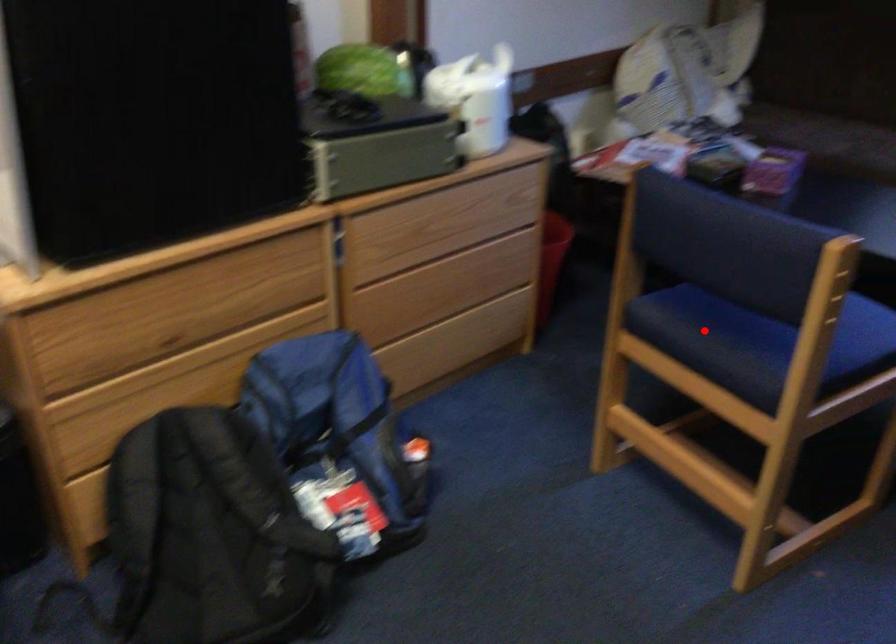
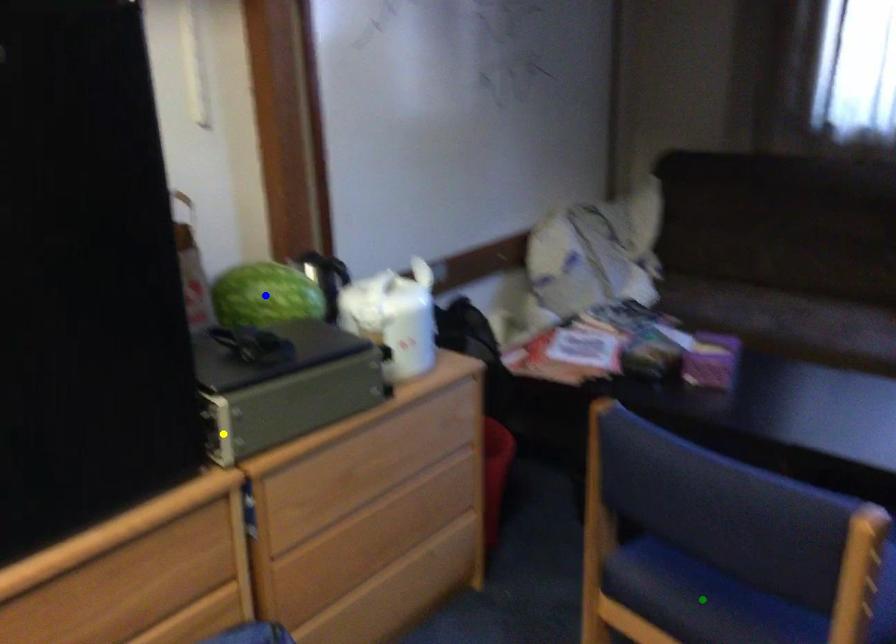
Question: I am providing you with two images of the same scene from different viewpoints. A red point is marked on the first image. You are given multiple points on the second image. In image 2, which mark is for the same physical point as the one in image 1?

Choices:
 (A) green point
 (B) yellow point
 (C) blue point

Answer: (A)